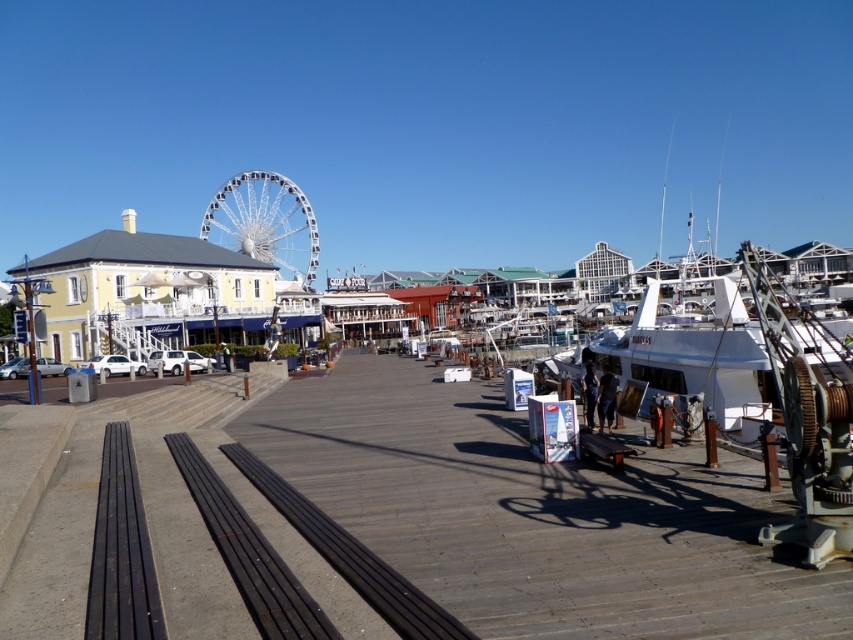
Is white matte boat at right to the right of white metallic ferris wheel at upper left from the viewer's perspective?

Correct, you'll find white matte boat at right to the right of white metallic ferris wheel at upper left.

Which is behind, point (714, 282) or point (291, 205)?

Point (291, 205)

Find the location of a particular element. white matte boat at right is located at coordinates (693, 348).

Between wooden at center and white matte boat at right, which one appears on the left side from the viewer's perspective?

From the viewer's perspective, wooden at center appears more on the left side.

Between wooden at center and white matte boat at right, which one is positioned lower?

wooden at center is below.

Is point (297, 452) farther from viewer compared to point (682, 304)?

That is False.

Where is `wooden at center`? This screenshot has width=853, height=640. wooden at center is located at coordinates (538, 515).

Which is more to the left, wooden at center or white metallic ferris wheel at upper left?

white metallic ferris wheel at upper left is more to the left.

Based on the photo, is wooden at center bigger than white metallic ferris wheel at upper left?

Actually, wooden at center might be smaller than white metallic ferris wheel at upper left.

Does point (424, 534) come farther from viewer compared to point (234, 173)?

No, it is not.

Identify the location of wooden at center. (538, 515).